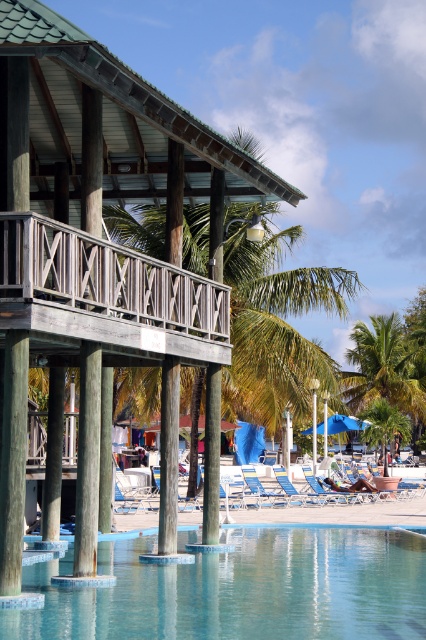
Question: Can you confirm if wooden hut at center is smaller than smooth wood pillar at center?

Choices:
 (A) no
 (B) yes

Answer: (A)

Question: Does green leafy palm tree at center-right have a smaller size compared to brown wood pillar at lower left?

Choices:
 (A) no
 (B) yes

Answer: (A)

Question: Does smooth wood pillar at center appear on the right side of blue fabric umbrella at center?

Choices:
 (A) no
 (B) yes

Answer: (A)

Question: Which point is farther to the camera?

Choices:
 (A) blue fabric beach chair at center
 (B) wooden hut at center

Answer: (A)

Question: Which of the following is the closest to the observer?

Choices:
 (A) blue fabric beach chair at center
 (B) brown wood pillar at lower left

Answer: (B)

Question: Considering the real-world distances, which object is closest to the brown wood pillar at lower left?

Choices:
 (A) blue fabric umbrella at center
 (B) smooth wood pillar at center

Answer: (B)